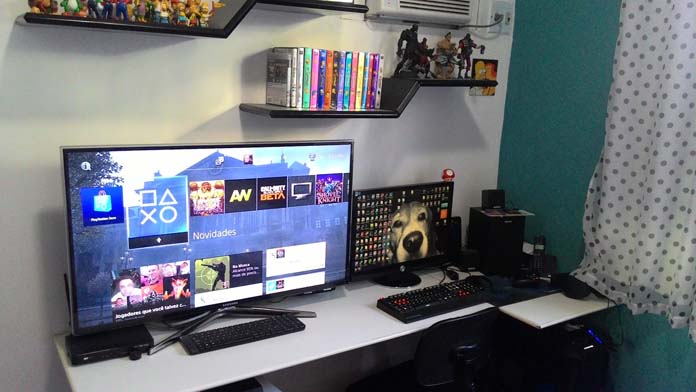
Identify the location of tv. (239, 231).